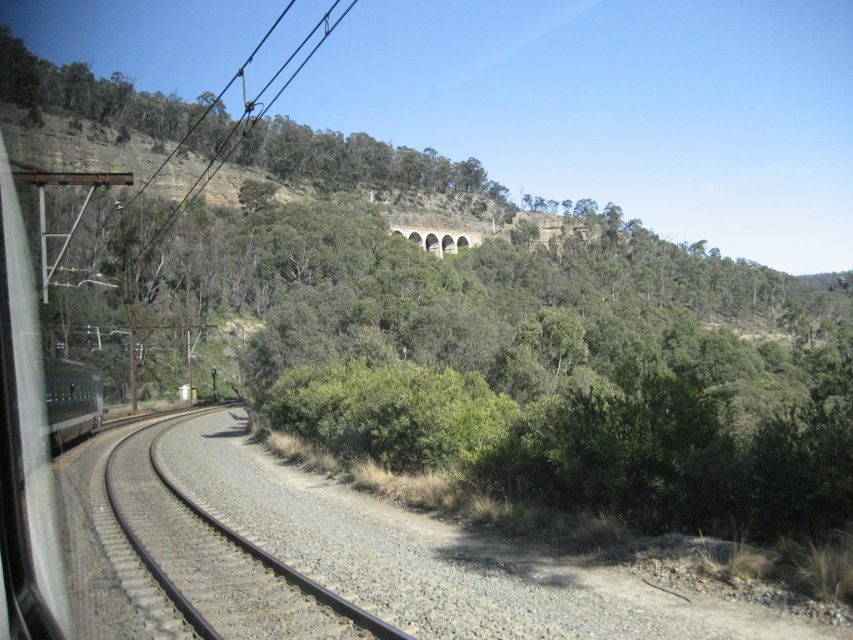
Question: Estimate the real-world distances between objects in this image. Which object is farther from the green matte train at left?

Choices:
 (A) stone arch bridge at upper center
 (B) brown gravel track at center

Answer: (A)

Question: Which is nearer to the brown gravel track at center?

Choices:
 (A) green matte train at left
 (B) stone arch bridge at upper center

Answer: (A)

Question: Is brown gravel track at center positioned before green matte train at left?

Choices:
 (A) yes
 (B) no

Answer: (A)

Question: Which of the following is the farthest from the observer?

Choices:
 (A) (352, 634)
 (B) (59, 419)

Answer: (B)

Question: Is brown gravel track at center to the right of stone arch bridge at upper center from the viewer's perspective?

Choices:
 (A) yes
 (B) no

Answer: (B)

Question: Can you confirm if brown gravel track at center is thinner than stone arch bridge at upper center?

Choices:
 (A) yes
 (B) no

Answer: (A)